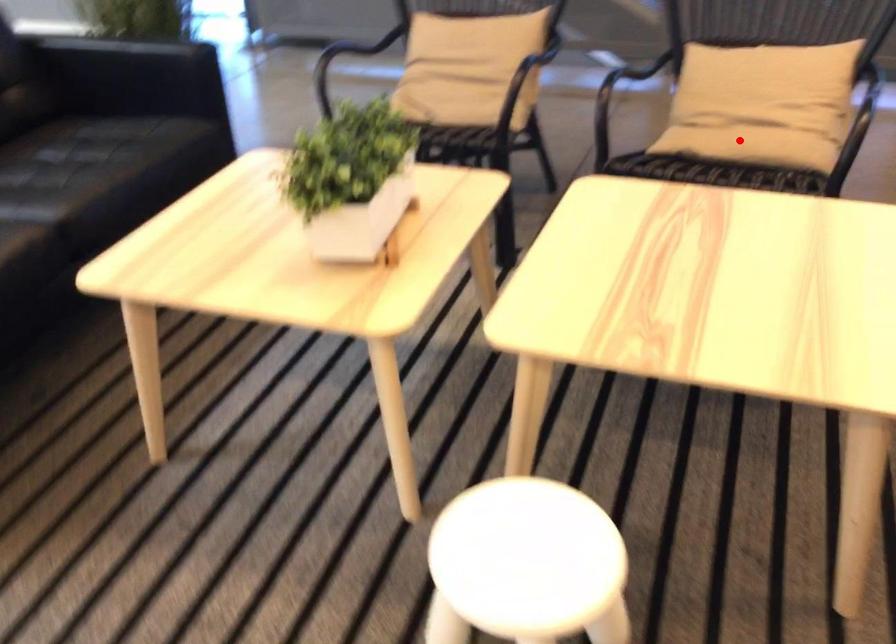
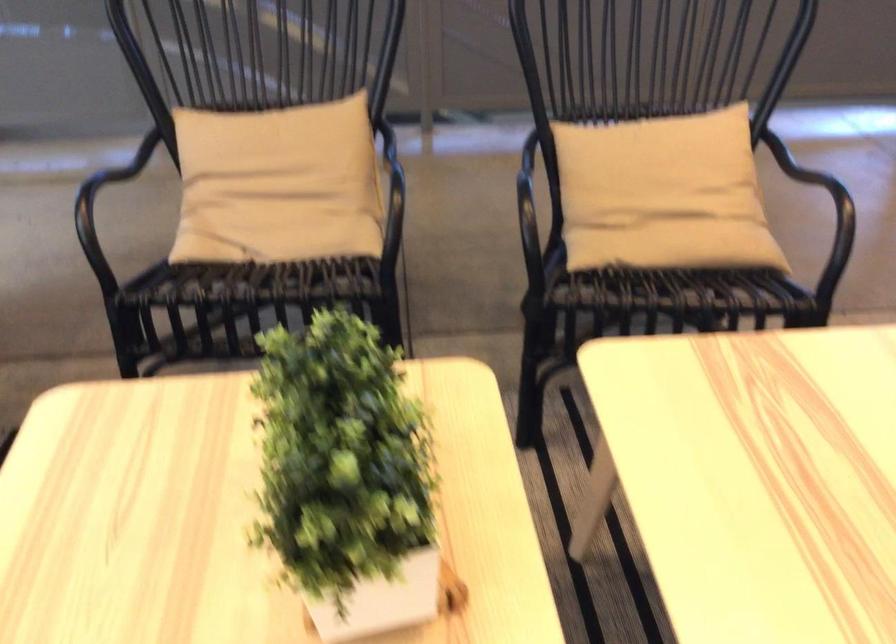
In the second image, find the point that corresponds to the highlighted location in the first image.

(674, 245)